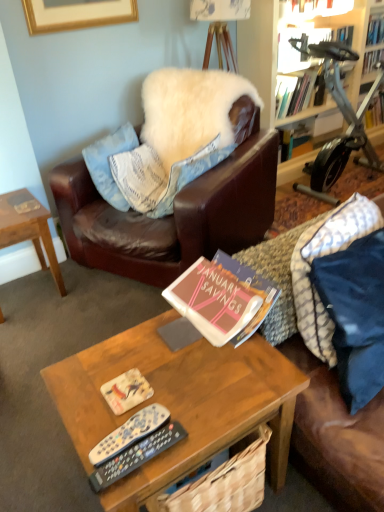
Question: Is hardcover book at upper right, which ranks as the third book in top-to-bottom order, closer to the viewer compared to blue fabric pillow at right, the 1th pillow from the front?

Choices:
 (A) yes
 (B) no

Answer: (B)

Question: Are hardcover book at upper right, the 3th book in the front-to-back sequence, and blue fabric pillow at right, which is the 3th pillow from back to front, far apart?

Choices:
 (A) yes
 (B) no

Answer: (A)

Question: Does hardcover book at upper right, the third book from the back, have a greater width compared to blue fabric pillow at right, the 1th pillow from the front?

Choices:
 (A) yes
 (B) no

Answer: (A)

Question: Is hardcover book at upper right, the third book from the back, positioned behind blue fabric pillow at right, the 1th pillow from the front?

Choices:
 (A) yes
 (B) no

Answer: (A)

Question: From a real-world perspective, is hardcover book at upper right, the 3th book in the front-to-back sequence, physically above blue fabric pillow at right, which is the 3th pillow from back to front?

Choices:
 (A) no
 (B) yes

Answer: (B)

Question: Is hardcover book at upper right, the 3th book in the front-to-back sequence, outside blue fabric pillow at right, which is the 3th pillow from back to front?

Choices:
 (A) no
 (B) yes

Answer: (B)

Question: Is hardcover book at upper center, which is counted as the 2th book, starting from the front, to the right of matte paper book cover at center from the viewer's perspective?

Choices:
 (A) no
 (B) yes

Answer: (B)

Question: Considering the relative positions of hardcover book at upper center, the fourth book viewed from the back, and matte paper book cover at center in the image provided, is hardcover book at upper center, the fourth book viewed from the back, in front of matte paper book cover at center?

Choices:
 (A) no
 (B) yes

Answer: (A)

Question: From a real-world perspective, is hardcover book at upper center, the fourth book viewed from the back, positioned under matte paper book cover at center based on gravity?

Choices:
 (A) no
 (B) yes

Answer: (A)

Question: Are hardcover book at upper center, which is counted as the 2th book, starting from the front, and matte paper book cover at center far apart?

Choices:
 (A) yes
 (B) no

Answer: (A)

Question: Does hardcover book at upper center, the 1th book viewed from the top, have a larger size compared to matte paper book cover at center?

Choices:
 (A) yes
 (B) no

Answer: (A)

Question: Is hardcover book at upper center, which is counted as the 2th book, starting from the front, shorter than matte paper book cover at center?

Choices:
 (A) yes
 (B) no

Answer: (B)

Question: Is woodenwoodencoffee table at center, the first coffee table when ordered from front to back, facing away from hardcover book at upper center, the fourth book viewed from the back?

Choices:
 (A) no
 (B) yes

Answer: (A)